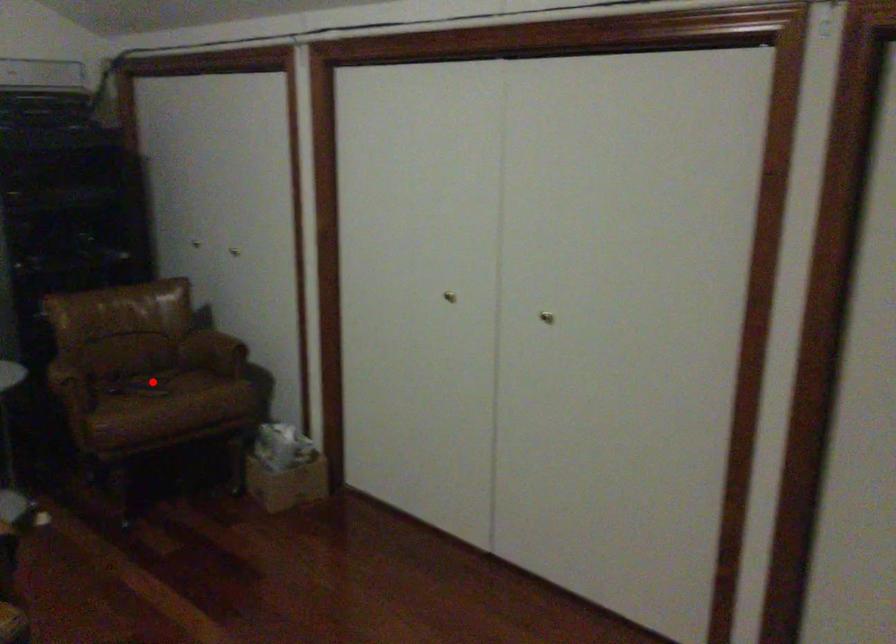
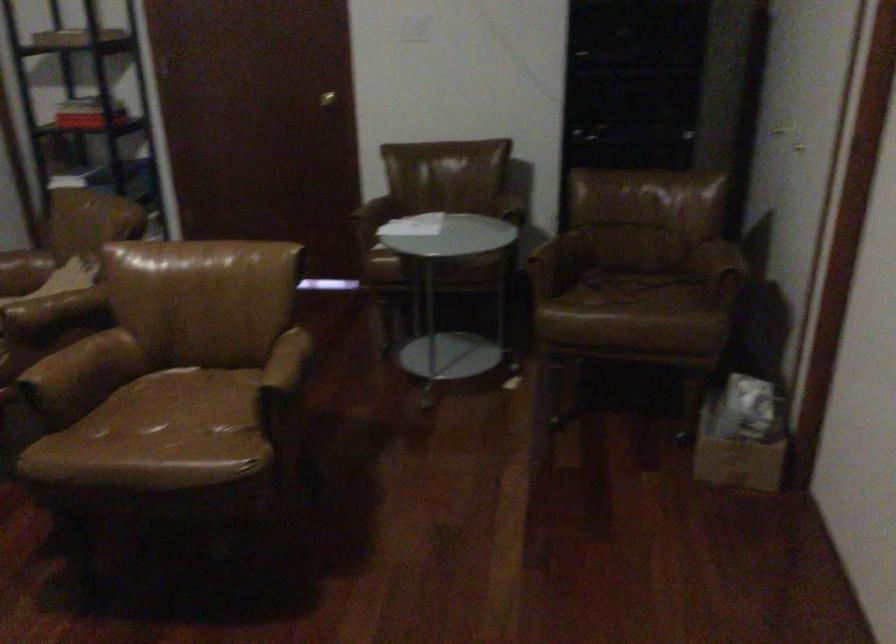
Find the pixel in the second image that matches the highlighted location in the first image.

(627, 288)